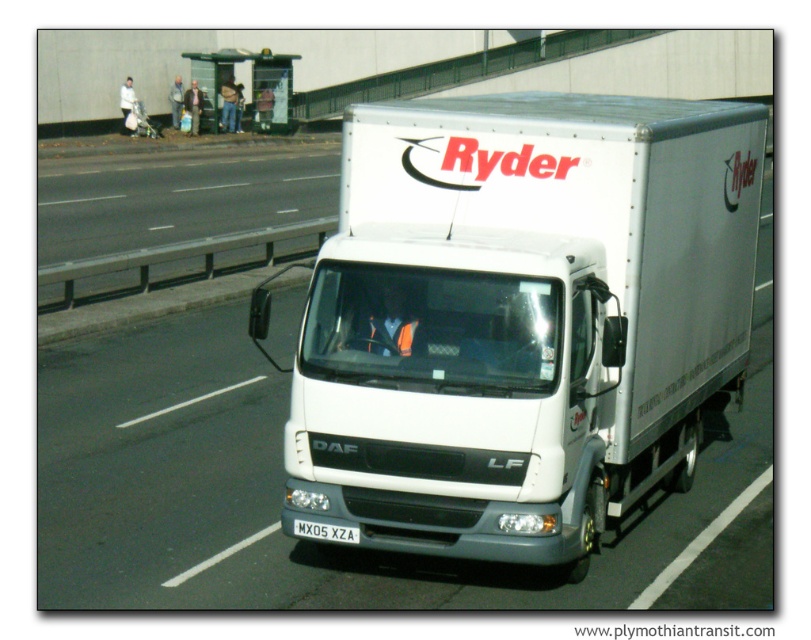
Question: Is the position of white matte truck at center more distant than that of white plastic license plate at center?

Choices:
 (A) no
 (B) yes

Answer: (A)

Question: Can you confirm if white matte truck at center is wider than white plastic license plate at center?

Choices:
 (A) yes
 (B) no

Answer: (A)

Question: Can you confirm if white matte truck at center is positioned to the right of white plastic license plate at center?

Choices:
 (A) no
 (B) yes

Answer: (B)

Question: Which of the following is the closest to the observer?

Choices:
 (A) pyautogui.click(x=676, y=406)
 (B) pyautogui.click(x=322, y=540)

Answer: (B)